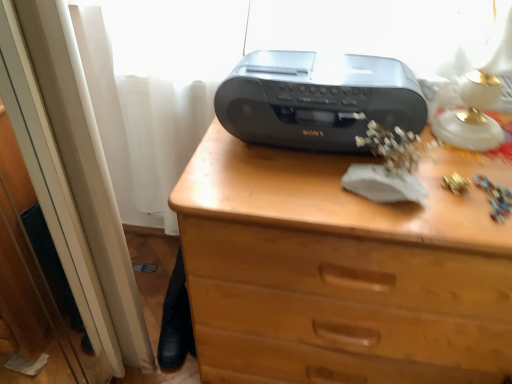
This screenshot has width=512, height=384. What are the coordinates of `free point above brown wooden chest of drawers at center (from a real-world perspective)` in the screenshot? It's located at (367, 165).